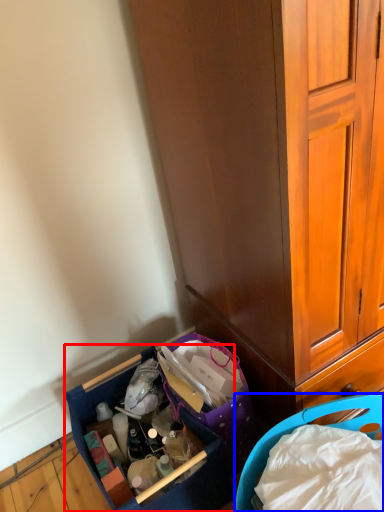
Question: Which object is closer to the camera taking this photo, picnic basket (highlighted by a red box) or picnic basket (highlighted by a blue box)?

Choices:
 (A) picnic basket
 (B) picnic basket

Answer: (B)